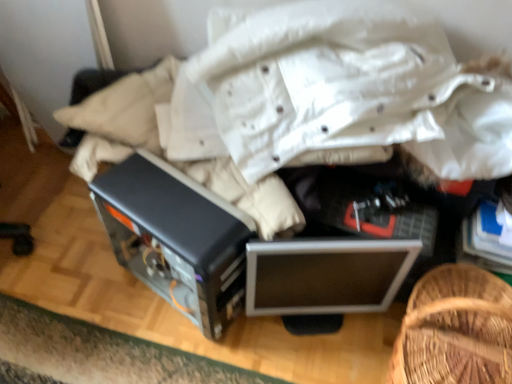
Locate an element on the screen. free point in front of satin black computer case at center is located at coordinates pyautogui.click(x=169, y=351).